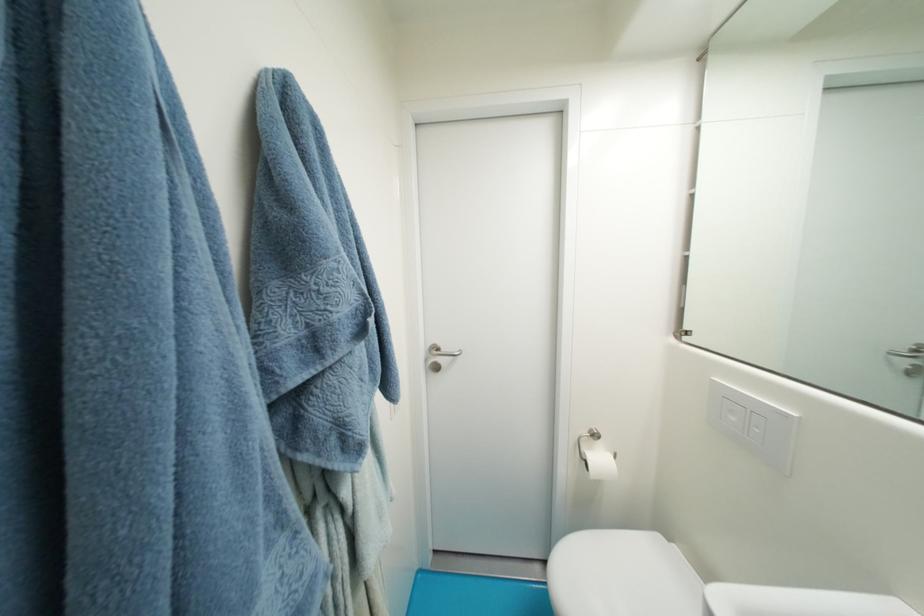
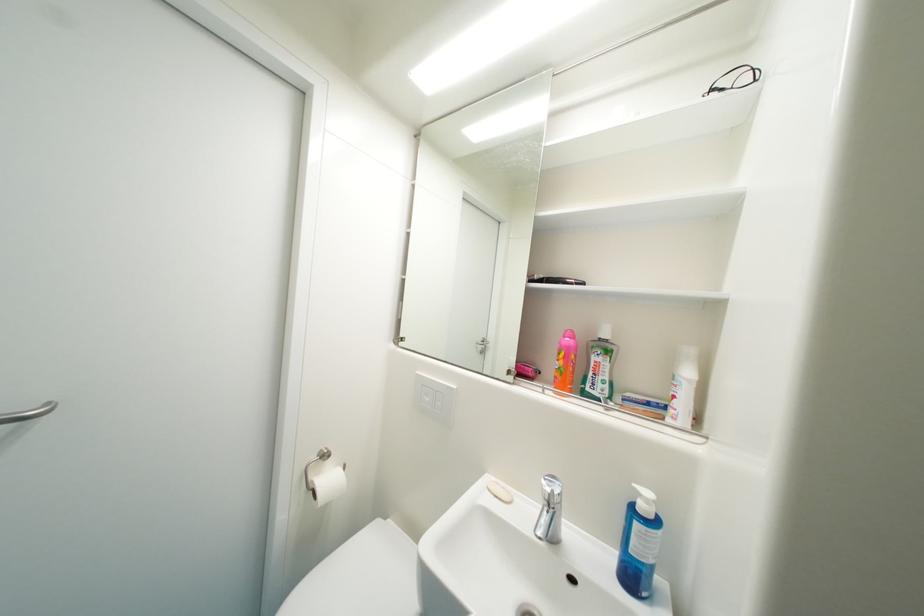
Find the pixel in the second image that matches (606,461) in the first image.

(337, 482)